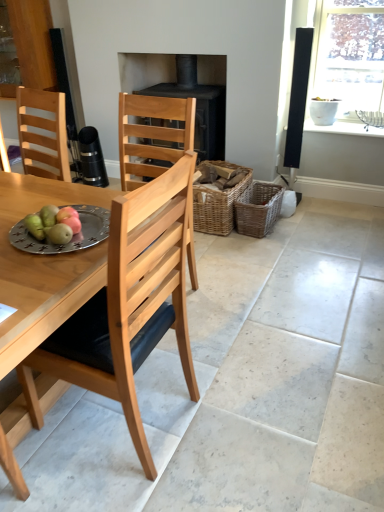
At what (x,y) coordinates should I click in order to perform the action: click on vacant area that lies to the right of woven brown basket at center-right, acting as the 1th basket starting from the right. Please return your answer as a coordinate pair (x, y). The height and width of the screenshot is (512, 384). Looking at the image, I should click on (296, 227).